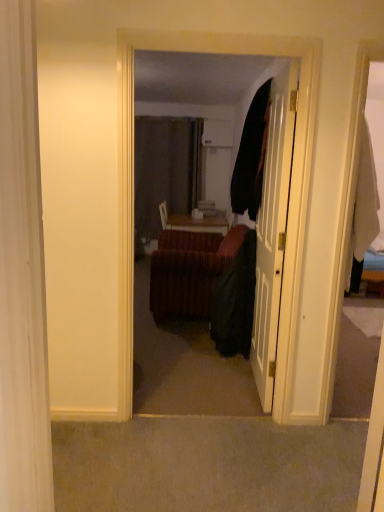
Question: Should I look upward or downward to see velvet couch at center?

Choices:
 (A) up
 (B) down

Answer: (A)

Question: From a real-world perspective, is black fabric robe at center beneath velvet-like brown couch at center?

Choices:
 (A) yes
 (B) no

Answer: (B)

Question: Is black fabric robe at center aimed at velvet-like brown couch at center?

Choices:
 (A) no
 (B) yes

Answer: (A)

Question: Is black fabric robe at center to the right of velvet-like brown couch at center from the viewer's perspective?

Choices:
 (A) no
 (B) yes

Answer: (B)

Question: Is black fabric robe at center at the left side of velvet-like brown couch at center?

Choices:
 (A) no
 (B) yes

Answer: (A)

Question: Does black fabric robe at center come behind velvet-like brown couch at center?

Choices:
 (A) no
 (B) yes

Answer: (A)

Question: From the image's perspective, is black fabric robe at center located beneath velvet-like brown couch at center?

Choices:
 (A) yes
 (B) no

Answer: (A)

Question: Is velvet-like brown couch at center not inside white glossy door at center?

Choices:
 (A) yes
 (B) no

Answer: (A)

Question: Is velvet-like brown couch at center wider than white glossy door at center?

Choices:
 (A) no
 (B) yes

Answer: (B)

Question: From the image's perspective, is velvet-like brown couch at center on top of white glossy door at center?

Choices:
 (A) yes
 (B) no

Answer: (B)

Question: Is the depth of velvet-like brown couch at center less than that of white glossy door at center?

Choices:
 (A) no
 (B) yes

Answer: (A)

Question: Does velvet-like brown couch at center have a lesser height compared to white glossy door at center?

Choices:
 (A) no
 (B) yes

Answer: (B)

Question: From a real-world perspective, is velvet-like brown couch at center physically above white glossy door at center?

Choices:
 (A) no
 (B) yes

Answer: (A)

Question: Does velvet couch at center contain black fabric robe at center?

Choices:
 (A) no
 (B) yes

Answer: (A)